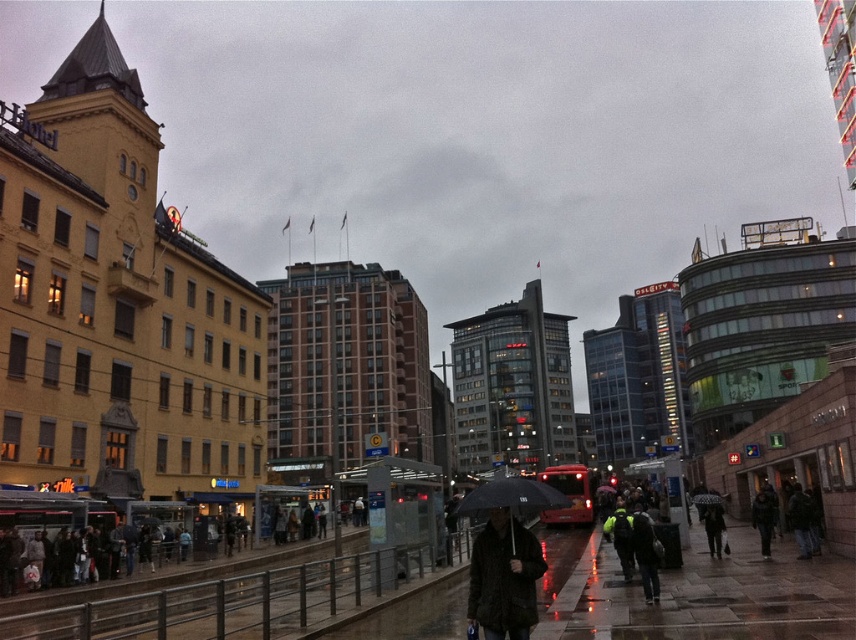
Question: Is black matte umbrella at center thinner than neon yellow jacket at center?

Choices:
 (A) no
 (B) yes

Answer: (A)

Question: From the image, what is the correct spatial relationship of black matte umbrella at center in relation to neon yellow jacket at center?

Choices:
 (A) below
 (B) above

Answer: (A)

Question: Among these objects, which one is farthest from the camera?

Choices:
 (A) shiny wet pavement at lower center
 (B) dark brown leather jacket at center
 (C) dark matte jacket at center

Answer: (C)

Question: Which point is farther from the camera taking this photo?

Choices:
 (A) pyautogui.click(x=705, y=499)
 (B) pyautogui.click(x=651, y=600)
 (C) pyautogui.click(x=591, y=609)
 (D) pyautogui.click(x=522, y=486)

Answer: (A)

Question: Which point is closer to the camera taking this photo?

Choices:
 (A) (519, 534)
 (B) (634, 508)

Answer: (A)

Question: Does neon yellow jacket at center have a lesser width compared to dark gray jacket at center?

Choices:
 (A) no
 (B) yes

Answer: (A)